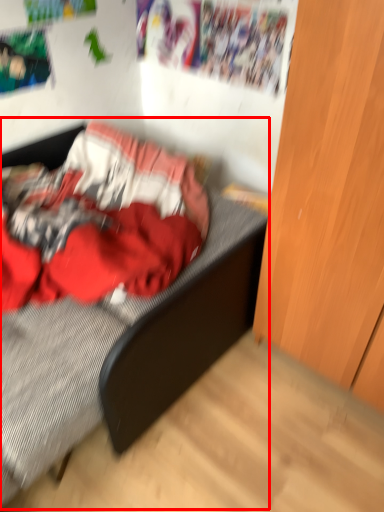
Question: From the image, what is the correct spatial relationship of bed (annotated by the red box) in relation to dresser?

Choices:
 (A) right
 (B) left

Answer: (B)